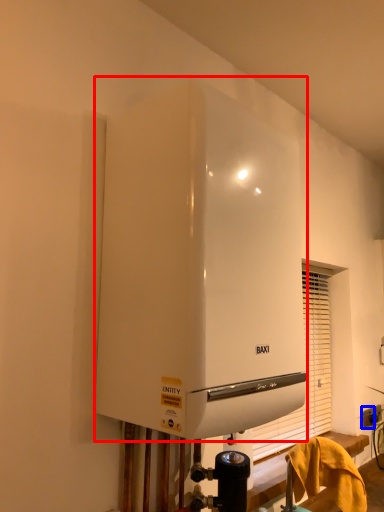
Question: Which object is closer to the camera taking this photo, home appliance (highlighted by a red box) or electric outlet (highlighted by a blue box)?

Choices:
 (A) home appliance
 (B) electric outlet

Answer: (A)